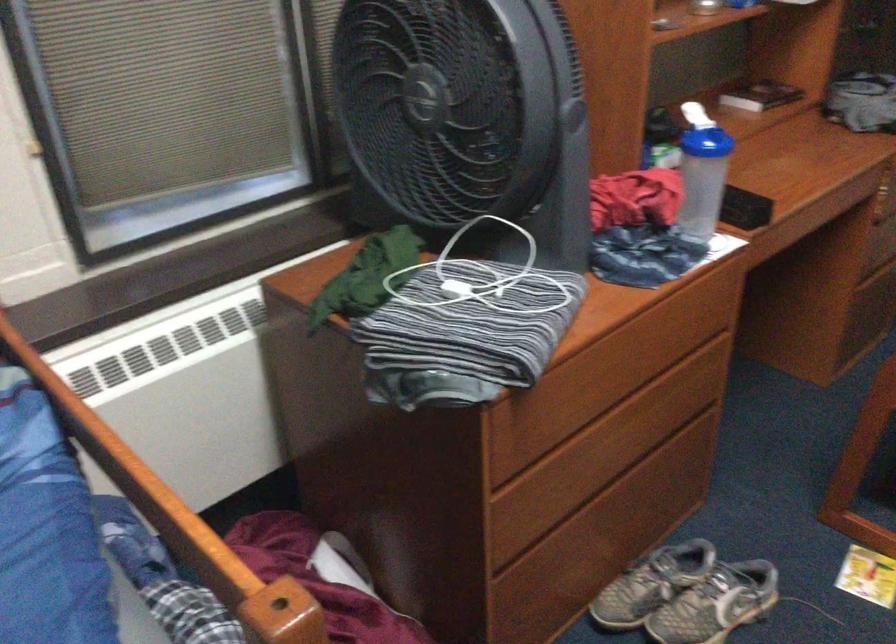
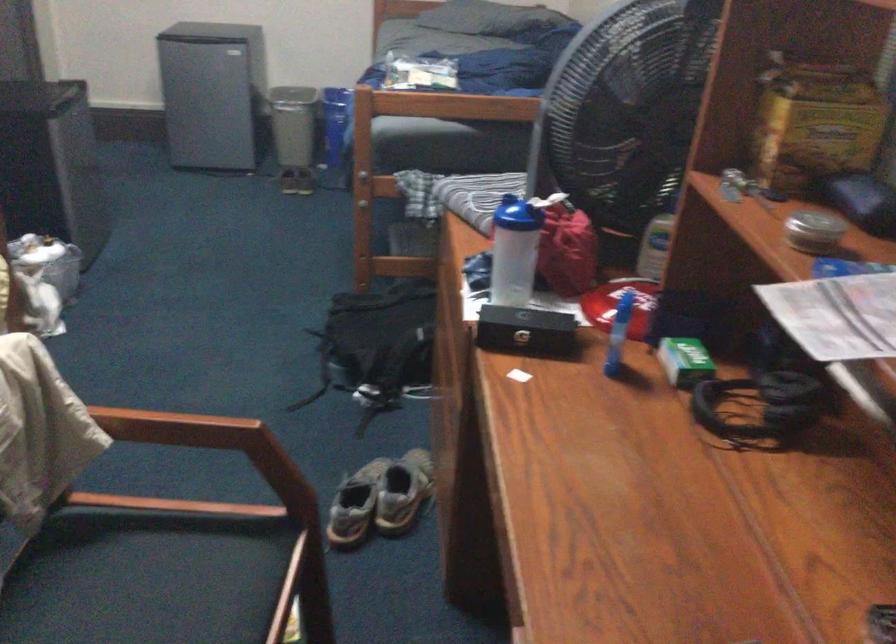
In the second image, find the point that corresponds to (x=711, y=140) in the first image.

(510, 214)